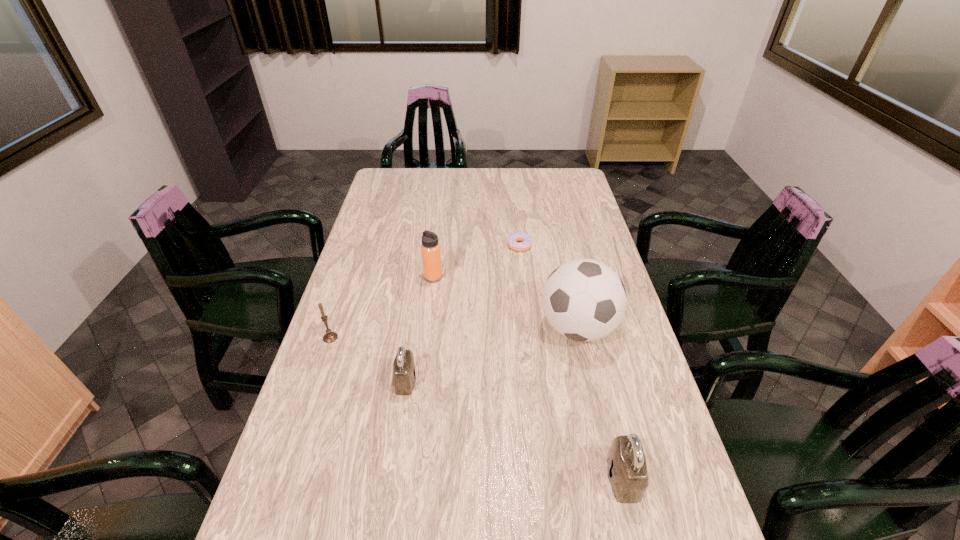
At what (x,y) coordinates should I click in order to perform the action: click on soccer ball present at the right edge. Please return your answer as a coordinate pair (x, y). The height and width of the screenshot is (540, 960). Looking at the image, I should click on (584, 300).

You are a GUI agent. You are given a task and a screenshot of the screen. Output one action in this format:
    pyautogui.click(x=<x>, y=<y>)
    Task: Click on the vacant space at the far edge
    Image resolution: width=960 pixels, height=540 pixels.
    Given the screenshot: What is the action you would take?
    pyautogui.click(x=468, y=188)

This screenshot has height=540, width=960. In the image, there is a desktop. What are the coordinates of `vacant space at the left edge` in the screenshot? It's located at (317, 443).

At what (x,y) coordinates should I click in order to perform the action: click on free spot at the right edge of the desktop. Please return your answer as a coordinate pair (x, y). Looking at the image, I should click on (599, 249).

Identify the location of blank area at the far right corner. (569, 170).

In the image, there is a desktop. Identify the location of vacant area at the near right corner. (648, 528).

Locate an element on the screen. The image size is (960, 540). free space between the candle and the right padlock is located at coordinates (477, 408).

Where is `free point between the farthest object and the second nearest object`? This screenshot has width=960, height=540. free point between the farthest object and the second nearest object is located at coordinates (463, 313).

Where is `vacant region between the right padlock and the farther padlock`? The image size is (960, 540). vacant region between the right padlock and the farther padlock is located at coordinates (515, 430).

Find the location of a particular element. This screenshot has height=540, width=960. unoccupied area between the thermos bottle and the shortest object is located at coordinates tap(476, 261).